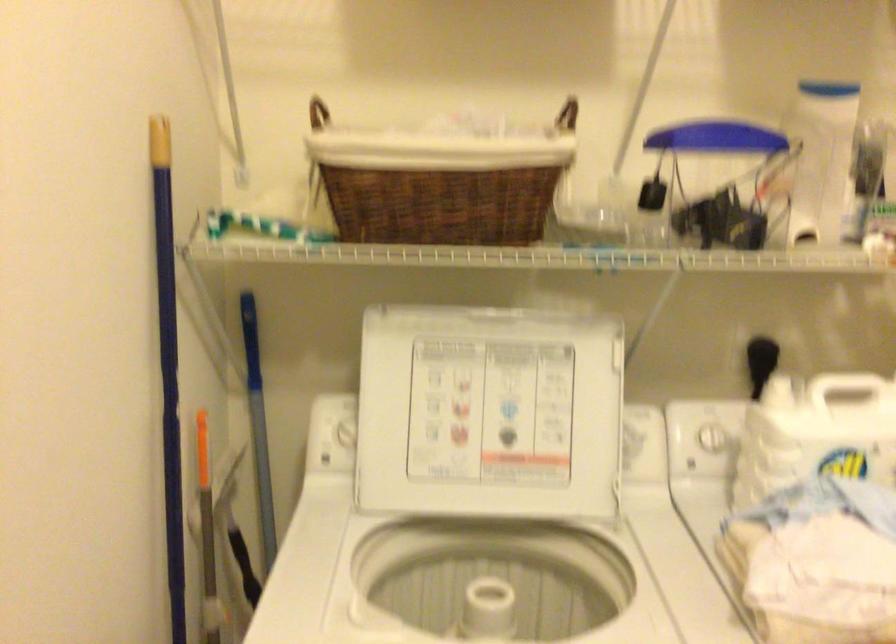
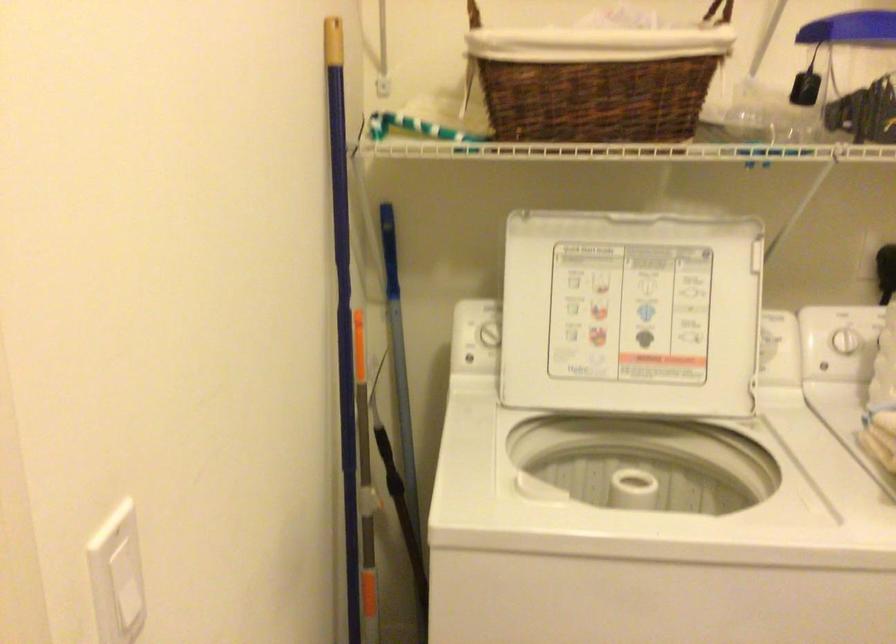
Where in the second image is the point corresponding to point (346, 433) from the first image?

(488, 334)